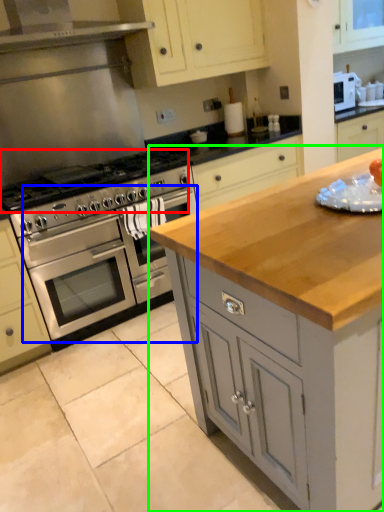
Question: Which is farther away from gas stove (highlighted by a red box)? oven (highlighted by a blue box) or cabinetry (highlighted by a green box)?

Choices:
 (A) oven
 (B) cabinetry

Answer: (B)